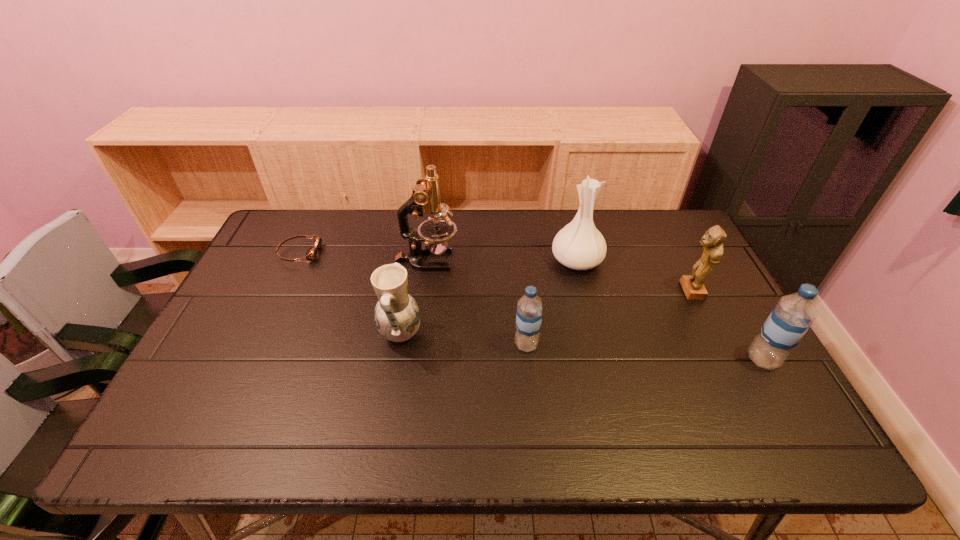
In the image, there is a desktop. Where is `free region at the far right corner`? The image size is (960, 540). free region at the far right corner is located at coordinates (683, 222).

Identify the location of free space at the near right corner of the desktop. (773, 390).

The image size is (960, 540). In order to click on free area in between the fourth nearest object and the microscope in this screenshot , I will do `click(559, 275)`.

I want to click on empty location between the second object from right to left and the taller water bottle, so [x=727, y=325].

At what (x,y) coordinates should I click in order to perform the action: click on vacant area that lies between the microscope and the fourth object from left to right. Please return your answer as a coordinate pair (x, y). The height and width of the screenshot is (540, 960). Looking at the image, I should click on (476, 302).

Find the location of `empty space between the right water bottle and the third object from right to left`. empty space between the right water bottle and the third object from right to left is located at coordinates (669, 310).

Identify the location of free spot between the shortest object and the pottery. (350, 294).

You are a GUI agent. You are given a task and a screenshot of the screen. Output one action in this format:
    pyautogui.click(x=<x>, y=<y>)
    Task: Click on the vacant space in between the pottery and the microscope
    The image size is (960, 540).
    Given the screenshot: What is the action you would take?
    pyautogui.click(x=414, y=297)

Locate an element on the screen. blank region between the goggles and the fifth object from left to right is located at coordinates (438, 257).

Find the location of a particular element. This screenshot has height=540, width=960. free space between the pottery and the right water bottle is located at coordinates (582, 347).